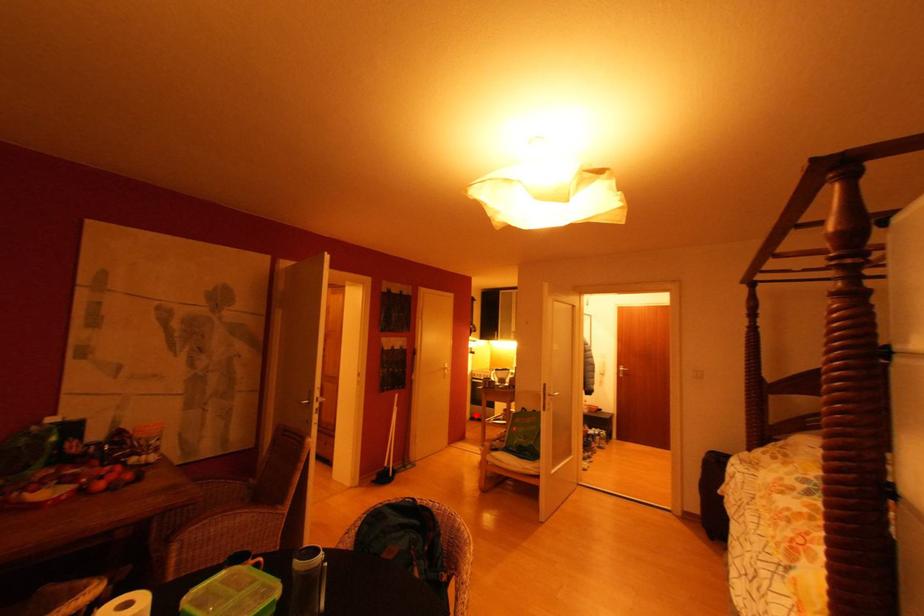
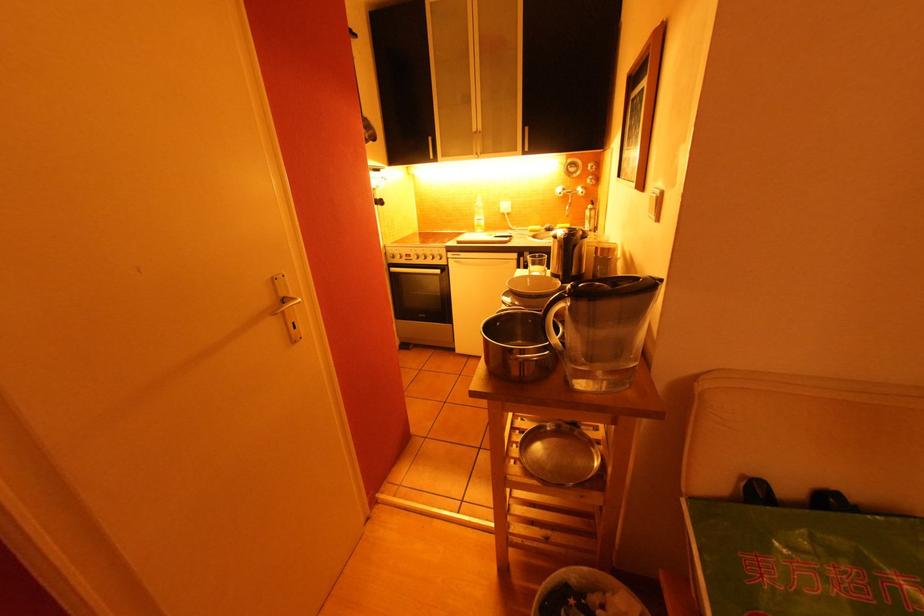
Question: I am providing you with two images of the same scene from different viewpoints. Given a red point in image1, look at the same physical point in image2. Is it:

Choices:
 (A) Closer to the viewpoint
 (B) Farther from the viewpoint

Answer: (A)